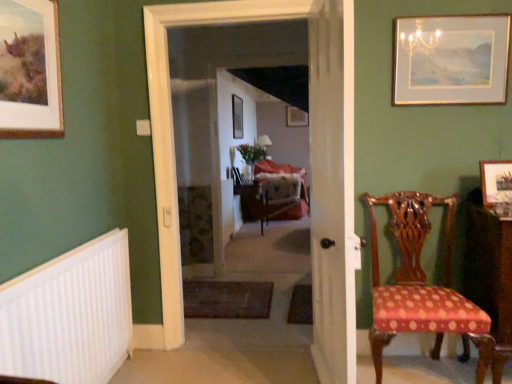
Question: Considering the relative positions of white plastic radiator at lower left and velvet upholstered swivel chair at center in the image provided, is white plastic radiator at lower left to the right of velvet upholstered swivel chair at center from the viewer's perspective?

Choices:
 (A) yes
 (B) no

Answer: (B)

Question: From the image's perspective, is white plastic radiator at lower left under velvet upholstered swivel chair at center?

Choices:
 (A) yes
 (B) no

Answer: (A)

Question: Is white plastic radiator at lower left shorter than velvet upholstered swivel chair at center?

Choices:
 (A) yes
 (B) no

Answer: (A)

Question: Is white plastic radiator at lower left at the left side of velvet upholstered swivel chair at center?

Choices:
 (A) yes
 (B) no

Answer: (A)

Question: Is white plastic radiator at lower left facing towards velvet upholstered swivel chair at center?

Choices:
 (A) no
 (B) yes

Answer: (A)

Question: In terms of size, does white wooden door at center appear bigger or smaller than carpeted floor at center, the 1th corridor positioned from the front?

Choices:
 (A) small
 (B) big

Answer: (A)

Question: From the image's perspective, is white wooden door at center located above or below carpeted floor at center, the 1th corridor positioned from the front?

Choices:
 (A) above
 (B) below

Answer: (B)

Question: Is white wooden door at center in front of or behind carpeted floor at center, the 1th corridor positioned from the front, in the image?

Choices:
 (A) front
 (B) behind

Answer: (A)

Question: From a real-world perspective, is white wooden door at center positioned above or below carpeted floor at center, which is the 2th corridor from back to front?

Choices:
 (A) above
 (B) below

Answer: (B)

Question: Considering the relative positions of velvet upholstered swivel chair at center and polka dot fabric chair at right in the image provided, is velvet upholstered swivel chair at center to the left or to the right of polka dot fabric chair at right?

Choices:
 (A) left
 (B) right

Answer: (A)

Question: From a real-world perspective, is velvet upholstered swivel chair at center physically located above or below polka dot fabric chair at right?

Choices:
 (A) above
 (B) below

Answer: (B)

Question: From their relative heights in the image, would you say velvet upholstered swivel chair at center is taller or shorter than polka dot fabric chair at right?

Choices:
 (A) tall
 (B) short

Answer: (B)

Question: In the image, is velvet upholstered swivel chair at center positioned in front of or behind polka dot fabric chair at right?

Choices:
 (A) front
 (B) behind

Answer: (B)

Question: Considering the positions of white wooden door at center and velvet upholstered swivel chair at center in the image, is white wooden door at center wider or thinner than velvet upholstered swivel chair at center?

Choices:
 (A) thin
 (B) wide

Answer: (A)

Question: From the image's perspective, is white wooden door at center positioned above or below velvet upholstered swivel chair at center?

Choices:
 (A) below
 (B) above

Answer: (A)